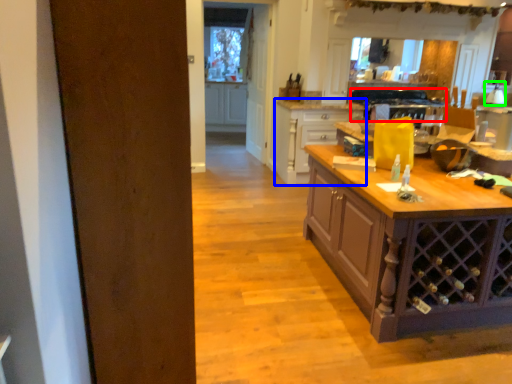
Question: Which object is the farthest from oven (highlighted by a red box)? Choose among these: cabinetry (highlighted by a blue box) or kitchen appliance (highlighted by a green box).

Choices:
 (A) cabinetry
 (B) kitchen appliance

Answer: (B)